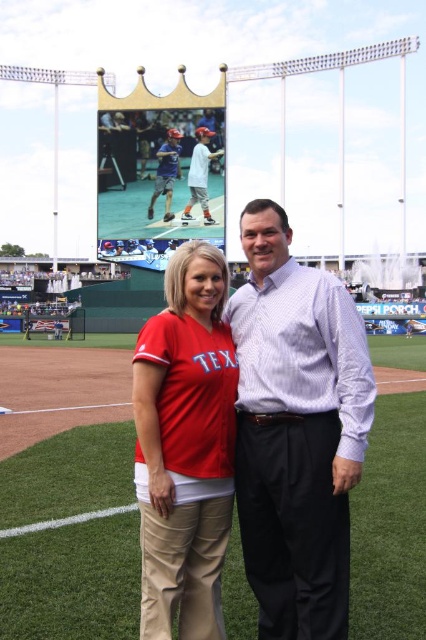
You are a photographer at the baseball stadium and notice two people wearing light blue shirt at center and matte blue shirt at center. Which one is closer to the camera?

The light blue shirt at center is in front of the matte blue shirt at center, so the light blue shirt at center is closer to the camera.

You are a photographer at the baseball stadium. You need to take a photo of the matte red jersey at center and the matte blue shirt at center so that both are fully visible. Based on their heights, which one should you position closer to the camera to avoid any part being cut off?

The matte red jersey at center is much taller than the matte blue shirt at center. To ensure both are fully visible in the photo, position the matte red jersey at center closer to the camera so that its full height can be captured without being cut off.

Consider the image. You are a photographer at the baseball stadium and want to take a photo of the matte red jersey at center and the matte blue shirt at center. Which one should you focus on first if you want to capture both clearly in the same frame?

The matte red jersey at center is closer to the viewer than the matte blue shirt at center, so you should focus on the matte red jersey at center first to ensure both are in focus.